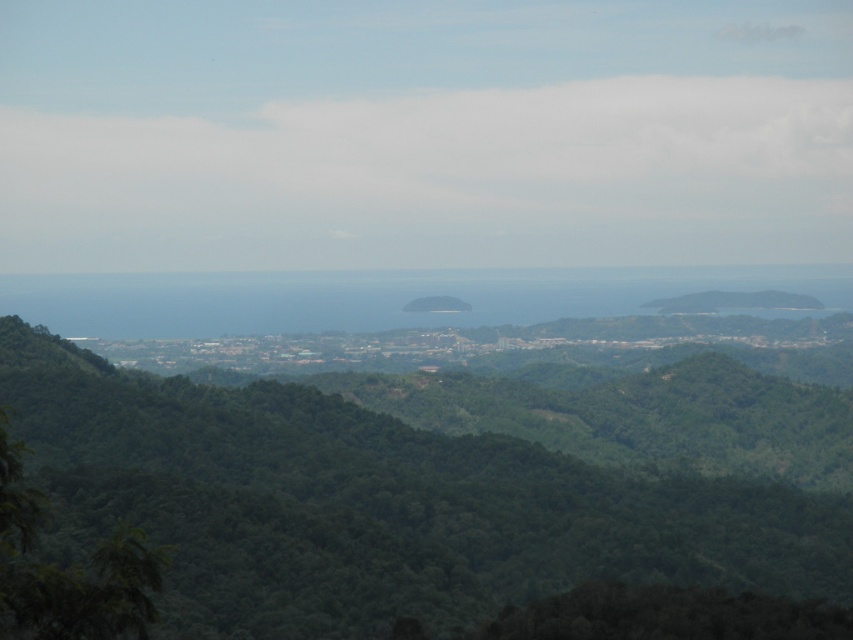
Who is taller, green leafy trees at center or green leafy tree at lower left?

green leafy trees at center is taller.

Can you confirm if green leafy trees at center is wider than green leafy tree at lower left?

Correct, the width of green leafy trees at center exceeds that of green leafy tree at lower left.

Locate an element on the screen. The image size is (853, 640). green leafy trees at center is located at coordinates (375, 506).